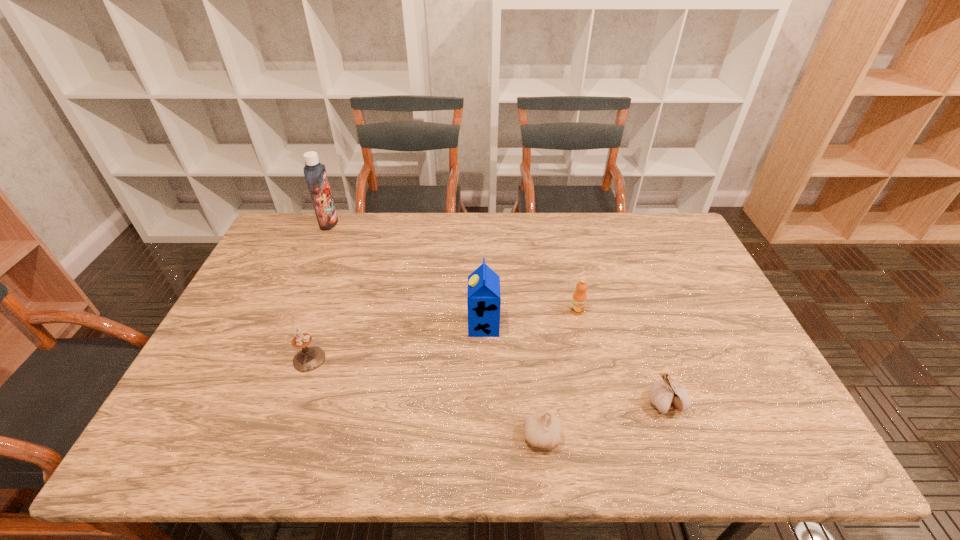
You are a GUI agent. You are given a task and a screenshot of the screen. Output one action in this format:
    pyautogui.click(x=<x>, y=<y>)
    Task: Click on the shorter garlic
    The width and height of the screenshot is (960, 540).
    Given the screenshot: What is the action you would take?
    pyautogui.click(x=542, y=429)

Identify the location of vacant space situated 0.260m on the front label of the tallest object. (409, 223).

This screenshot has height=540, width=960. Find the location of `vacant space located with the cap open on the second tallest object`. vacant space located with the cap open on the second tallest object is located at coordinates (408, 326).

The width and height of the screenshot is (960, 540). I want to click on free space located with the cap open on the second tallest object, so click(x=425, y=326).

I want to click on free spot located 0.090m with the cap open on the second tallest object, so click(436, 326).

Locate an element on the screen. vacant space located on the back of the candle holder is located at coordinates (324, 316).

This screenshot has height=540, width=960. What are the coordinates of `free space located 0.080m on the front label of the orange juice` in the screenshot? It's located at (583, 337).

Locate an element on the screen. The image size is (960, 540). vacant space located 0.390m on the left of the farther garlic is located at coordinates (483, 403).

Locate an element on the screen. The height and width of the screenshot is (540, 960). vacant space located 0.300m on the left of the third object from right to left is located at coordinates (390, 436).

The image size is (960, 540). I want to click on object located at the far edge, so click(x=315, y=173).